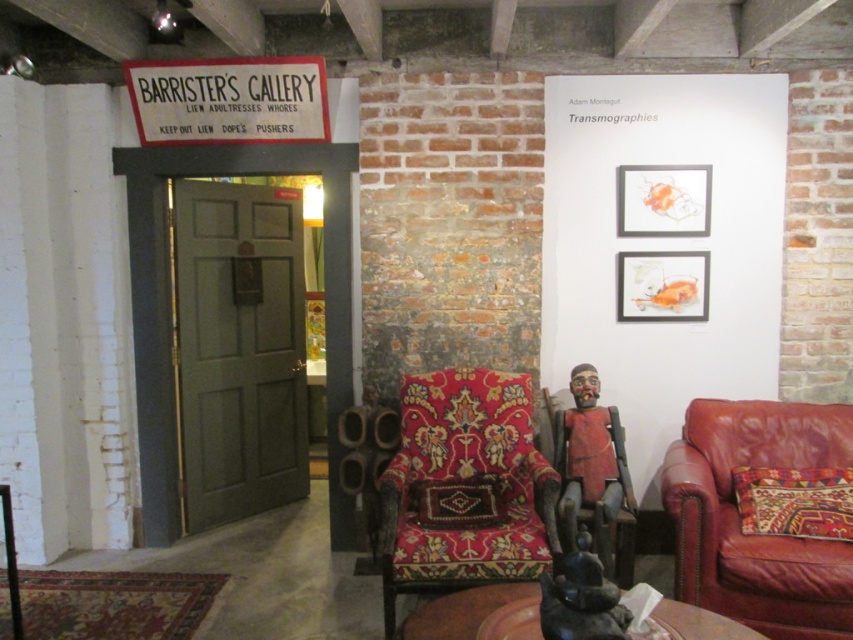
Question: Which of the following is the closest to the observer?

Choices:
 (A) leather armchair at right
 (B) matte silver picture frame at upper right
 (C) velvet-patterned armchair at center
 (D) matte orange painting at upper right

Answer: (A)

Question: Considering the relative positions of velvet-patterned armchair at center and wooden armchair at center in the image provided, where is velvet-patterned armchair at center located with respect to wooden armchair at center?

Choices:
 (A) right
 (B) left

Answer: (B)

Question: Can you confirm if leather armchair at right is thinner than wooden armchair at center?

Choices:
 (A) yes
 (B) no

Answer: (B)

Question: Is matte silver picture frame at upper right smaller than matte orange painting at upper right?

Choices:
 (A) yes
 (B) no

Answer: (A)

Question: Which of these objects is positioned farthest from the wooden armchair at center?

Choices:
 (A) leather armchair at right
 (B) matte silver picture frame at upper right
 (C) matte orange painting at upper right

Answer: (B)

Question: Which point appears closest to the camera in this image?

Choices:
 (A) (634, 304)
 (B) (648, 216)

Answer: (B)